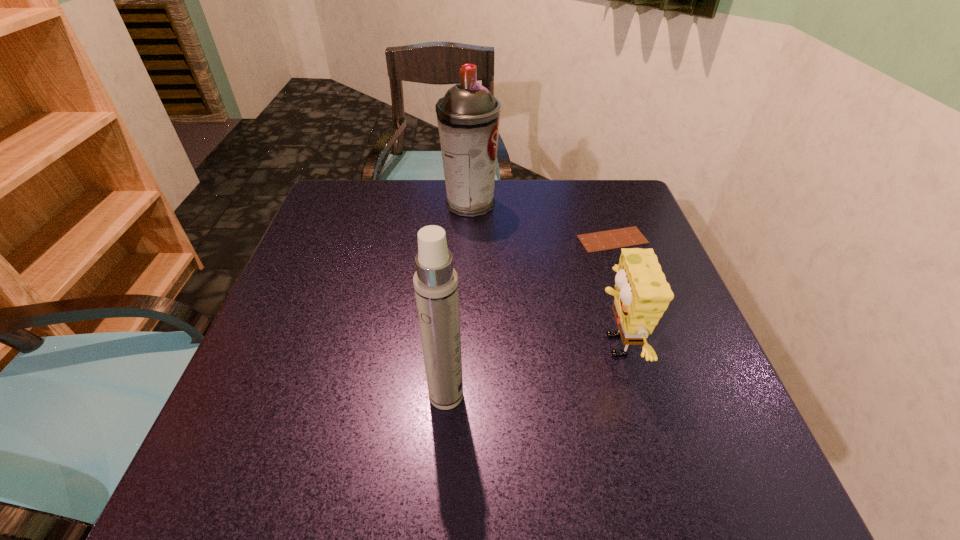
Find the location of a particular element. vacant space located 0.260m on the left of the shortest object is located at coordinates (472, 240).

Identify the location of aerosol can that is at the far edge. This screenshot has width=960, height=540. (468, 116).

Locate an element on the screen. The width and height of the screenshot is (960, 540). chocolate bar located at the far edge is located at coordinates (624, 237).

Where is `sponge present at the right edge`? Image resolution: width=960 pixels, height=540 pixels. sponge present at the right edge is located at coordinates click(x=642, y=294).

This screenshot has height=540, width=960. In order to click on chocolate bar that is at the right edge in this screenshot , I will do `click(624, 237)`.

Where is `object at the far right corner`? This screenshot has height=540, width=960. object at the far right corner is located at coordinates (624, 237).

The height and width of the screenshot is (540, 960). In the image, there is a desktop. What are the coordinates of `free region at the far edge` in the screenshot? It's located at (553, 204).

At what (x,y) coordinates should I click in order to perform the action: click on free point at the near edge. Please return your answer as a coordinate pair (x, y). Looking at the image, I should click on (429, 499).

This screenshot has height=540, width=960. What are the coordinates of `blank space at the left edge` in the screenshot? It's located at (252, 418).

You are a GUI agent. You are given a task and a screenshot of the screen. Output one action in this format:
    pyautogui.click(x=<x>, y=<y>)
    Task: Click on the vacant space at the right edge
    The image size is (960, 540).
    Given the screenshot: What is the action you would take?
    pyautogui.click(x=684, y=311)